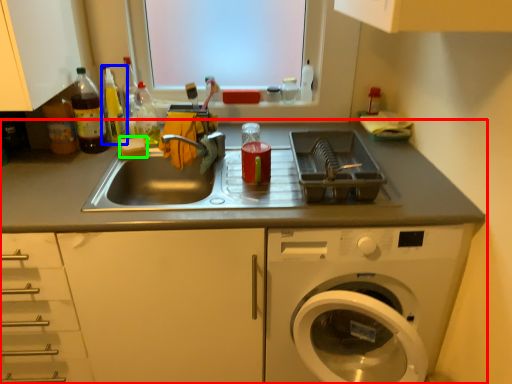
Question: Which object is the farthest from countertop (highlighted by a red box)? Choose among these: bottle (highlighted by a blue box) or food (highlighted by a green box).

Choices:
 (A) bottle
 (B) food

Answer: (A)